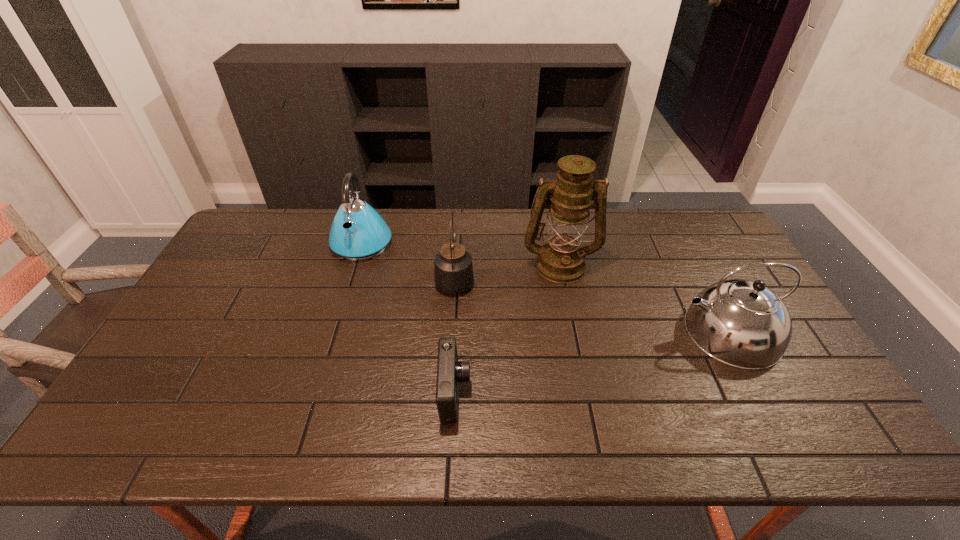
Where is `free spot located spout on the second kettle from right to left`? free spot located spout on the second kettle from right to left is located at coordinates (458, 226).

The height and width of the screenshot is (540, 960). I want to click on blank space located 0.280m spout on the second kettle from right to left, so click(459, 212).

In order to click on free space located from the spout of the rightmost kettle in this screenshot , I will do `click(631, 332)`.

This screenshot has width=960, height=540. In order to click on free region located 0.370m from the spout of the rightmost kettle in this screenshot , I will do `click(544, 332)`.

At what (x,y) coordinates should I click in order to perform the action: click on free location located 0.140m from the spout of the rightmost kettle. Please return your answer as a coordinate pair (x, y). Looking at the image, I should click on (627, 332).

At what (x,y) coordinates should I click in order to perform the action: click on vacant space situated 0.120m on the front-facing side of the shortest object. Please return your answer as a coordinate pair (x, y). This screenshot has height=540, width=960. Looking at the image, I should click on (519, 393).

The width and height of the screenshot is (960, 540). I want to click on oil lamp located at the far edge, so click(562, 260).

Locate an element on the screen. The image size is (960, 540). kettle that is positioned at the far edge is located at coordinates click(358, 232).

Identify the location of object that is at the near edge. The height and width of the screenshot is (540, 960). (449, 371).

The height and width of the screenshot is (540, 960). In order to click on object that is at the right edge in this screenshot , I will do `click(741, 323)`.